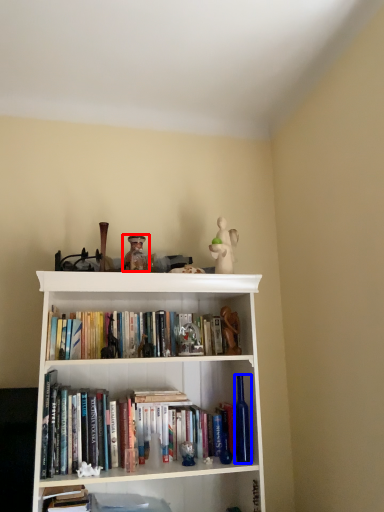
Question: Among these objects, which one is nearest to the camera, toy (highlighted by a red box) or bottle (highlighted by a blue box)?

Choices:
 (A) toy
 (B) bottle

Answer: (B)